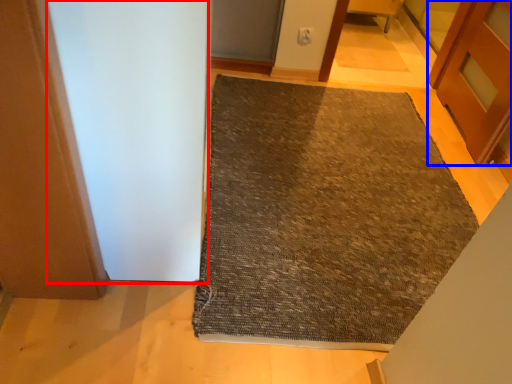
Question: Among these objects, which one is farthest to the camera, screen door (highlighted by a red box) or door (highlighted by a blue box)?

Choices:
 (A) screen door
 (B) door

Answer: (B)